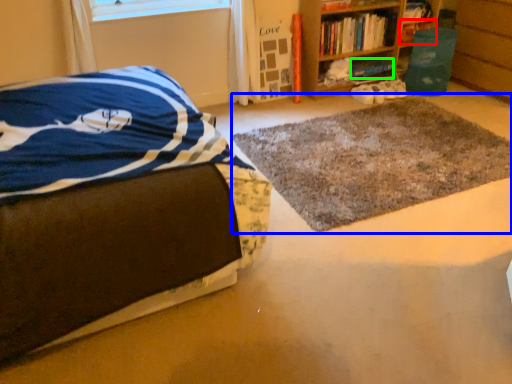
Question: Considering the real-world distances, which object is closest to book (highlighted by a red box)? mat (highlighted by a blue box) or book (highlighted by a green box).

Choices:
 (A) mat
 (B) book

Answer: (B)